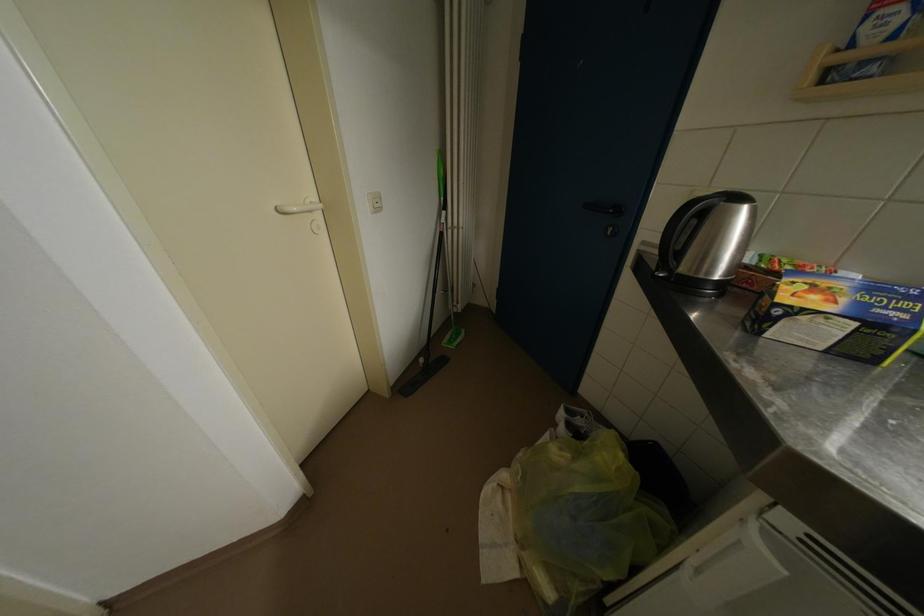
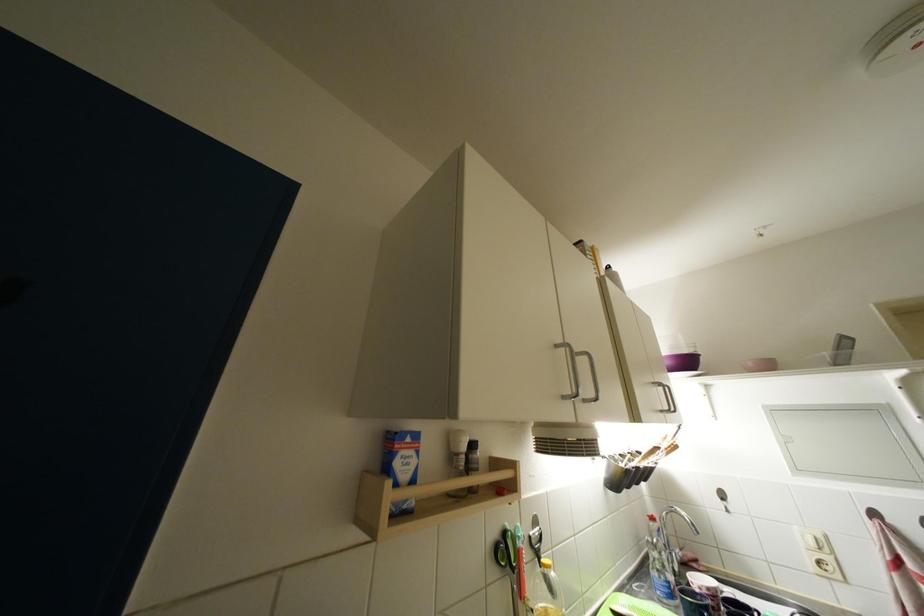
Find the pixel in the second image that matches [874,30] in the first image.

(404, 467)